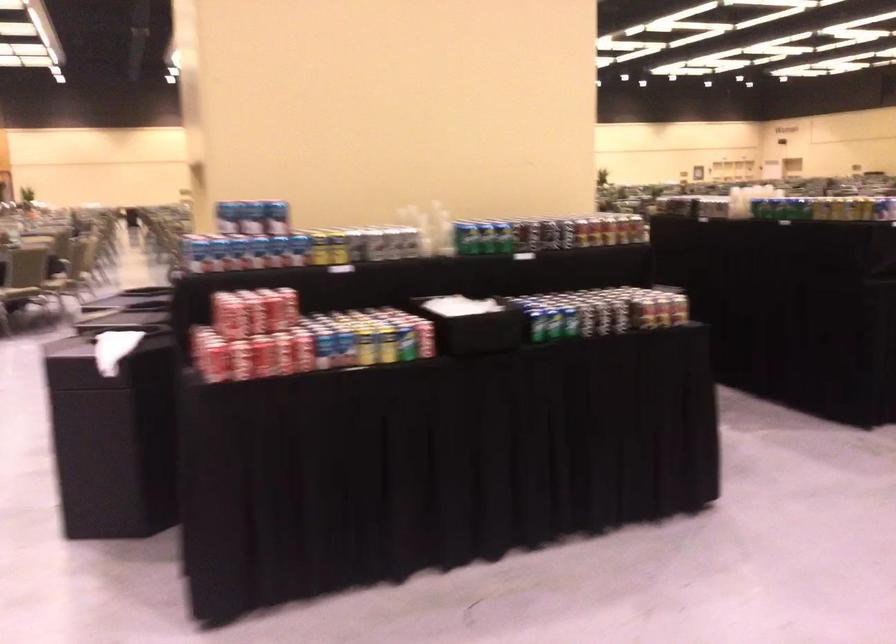
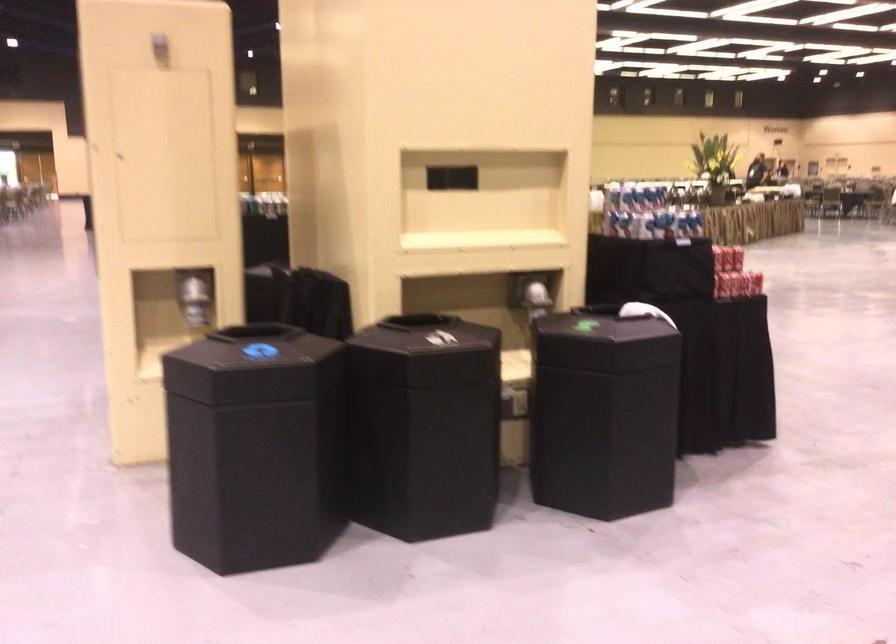
Question: I am providing you with two images of the same scene from different viewpoints. Please identify which objects are invisible in image2.

Choices:
 (A) metal trash can lid
 (B) shiny dispenser lever
 (C) black bin lid
 (D) yellow soda can

Answer: (D)